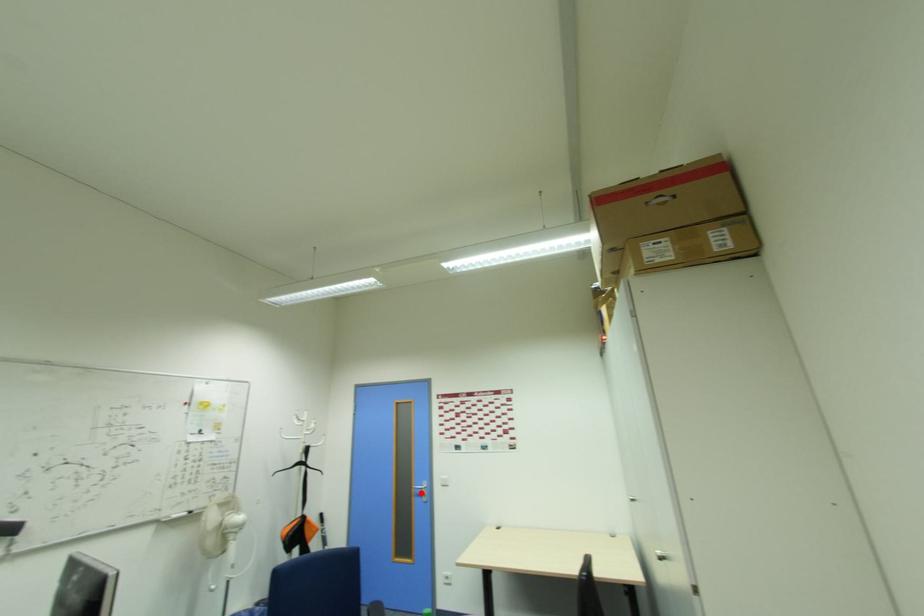
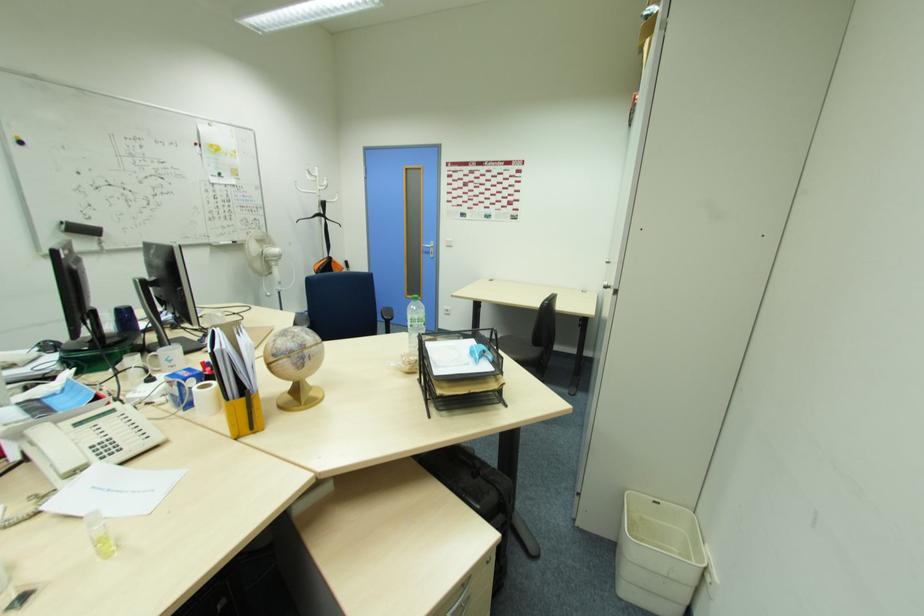
The point at the highlighted location is marked in the first image. Where is the corresponding point in the second image?

(430, 252)